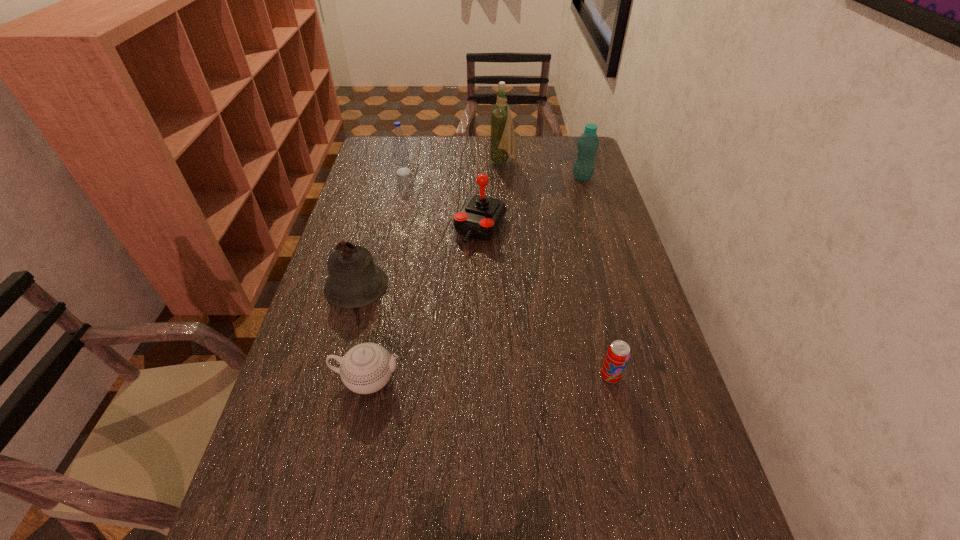
Locate an element on the screen. unoccupied area between the tallest object and the chinaware is located at coordinates (436, 271).

You are a GUI agent. You are given a task and a screenshot of the screen. Output one action in this format:
    pyautogui.click(x=<x>, y=<y>)
    Task: Click on the vacant point located between the bell and the fourth farthest object
    The width and height of the screenshot is (960, 540).
    Given the screenshot: What is the action you would take?
    pyautogui.click(x=419, y=256)

At what (x,y) coordinates should I click in order to perform the action: click on free area in between the left water bottle and the joystick. Please return your answer as a coordinate pair (x, y). Looking at the image, I should click on (443, 200).

Where is `free spot between the soda can and the joystick`? free spot between the soda can and the joystick is located at coordinates (545, 302).

Select which object is the closest to the chinaware. Please provide its 2D coordinates. Your answer should be formatted as a tuple, i.e. [(x, y)], where the tuple contains the x and y coordinates of a point satisfying the conditions above.

[(355, 281)]

The width and height of the screenshot is (960, 540). What are the coordinates of `object that is the second nearest to the chinaware` in the screenshot? It's located at (480, 217).

At what (x,y) coordinates should I click in order to perform the action: click on free space that satisfies the following two spatial constraints: 1. on the front-facing side of the soda can; 2. on the right side of the tallest object. Please return your answer as a coordinate pair (x, y). This screenshot has width=960, height=540. Looking at the image, I should click on (517, 376).